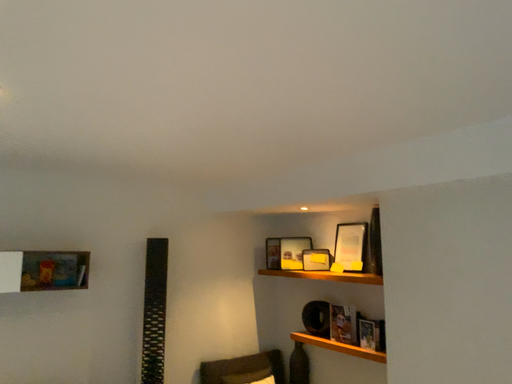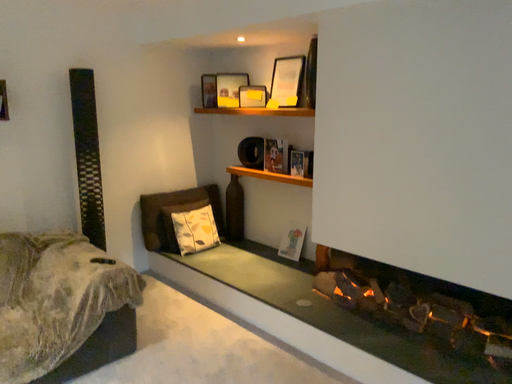
Question: Which way did the camera rotate in the video?

Choices:
 (A) rotated right
 (B) rotated left

Answer: (A)